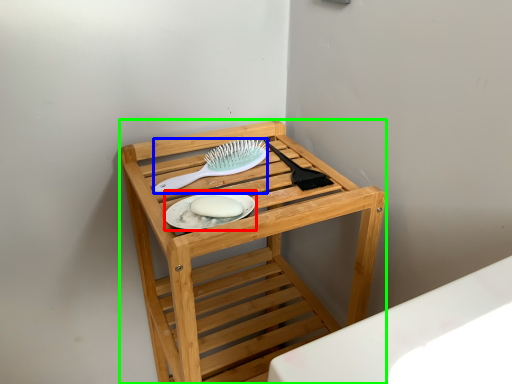
Question: Based on their relative distances, which object is farther from platter (highlighted by a red box)? Choose from brush (highlighted by a blue box) and furniture (highlighted by a green box).

Choices:
 (A) brush
 (B) furniture

Answer: (B)